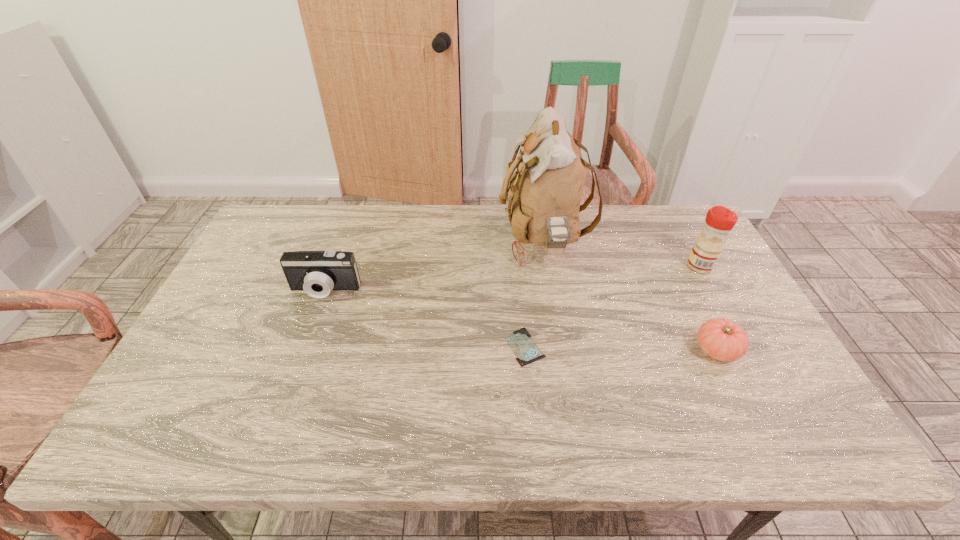
Identify the location of free spot that satisfies the following two spatial constraints: 1. on the lens of the tomato; 2. on the left side of the camcorder. (303, 350).

Identify the location of free space that satisfies the following two spatial constraints: 1. on the front-facing side of the second shortest object; 2. on the left side of the tallest object. This screenshot has width=960, height=540. (561, 350).

You are a GUI agent. You are given a task and a screenshot of the screen. Output one action in this format:
    pyautogui.click(x=<x>, y=<y>)
    Task: Click on the free space that satisfies the following two spatial constraints: 1. on the front-facing side of the tallest object; 2. on the back side of the second shortest object
    The image size is (960, 540).
    Given the screenshot: What is the action you would take?
    pyautogui.click(x=561, y=350)

Image resolution: width=960 pixels, height=540 pixels. I want to click on vacant region that satisfies the following two spatial constraints: 1. on the back side of the shortest object; 2. on the left side of the condiment, so [x=517, y=266].

The height and width of the screenshot is (540, 960). I want to click on vacant space that satisfies the following two spatial constraints: 1. on the front-facing side of the backpack; 2. on the back side of the condiment, so click(547, 266).

Find the location of a particular element. Image resolution: width=960 pixels, height=540 pixels. free spot that satisfies the following two spatial constraints: 1. on the lens of the tomato; 2. on the right side of the camcorder is located at coordinates (303, 350).

At what (x,y) coordinates should I click in order to perform the action: click on free location that satisfies the following two spatial constraints: 1. on the back side of the condiment; 2. on the left side of the identity card. Please return your answer as a coordinate pair (x, y). The width and height of the screenshot is (960, 540). Looking at the image, I should click on (517, 266).